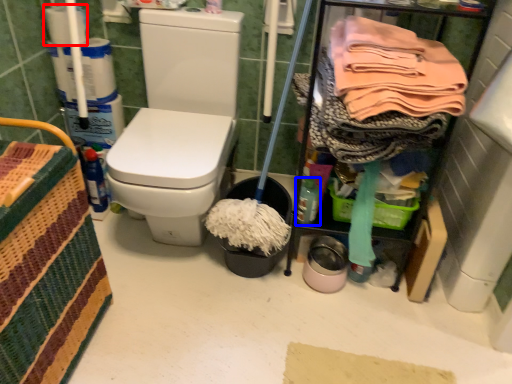
Question: Which object appears closest to the camera in this image, toilet paper (highlighted by a red box) or bottle (highlighted by a blue box)?

Choices:
 (A) toilet paper
 (B) bottle

Answer: (B)